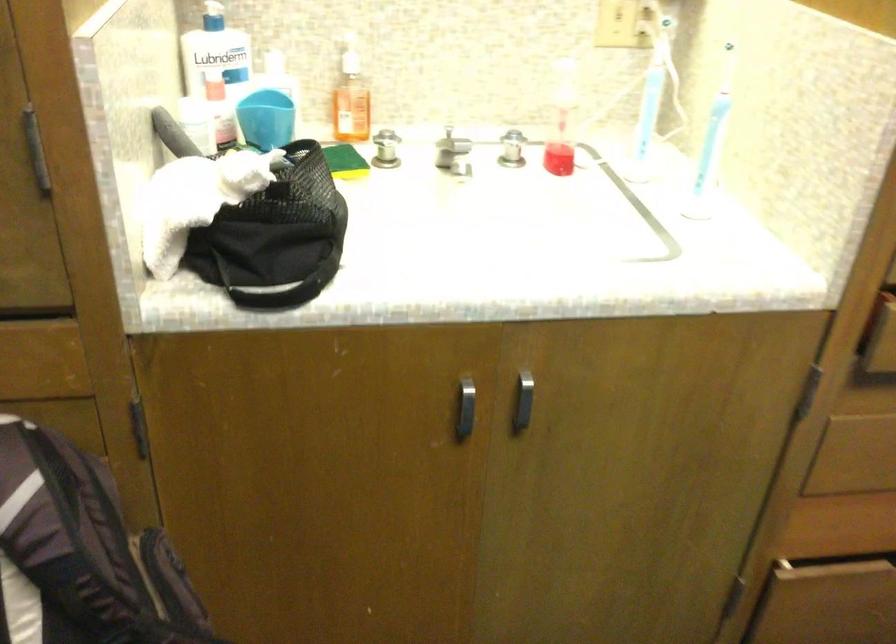
Question: Based on the continuous images, in which direction is the camera rotating? Reply with the corresponding letter.

Choices:
 (A) Left
 (B) Right
 (C) Up
 (D) Down

Answer: (A)